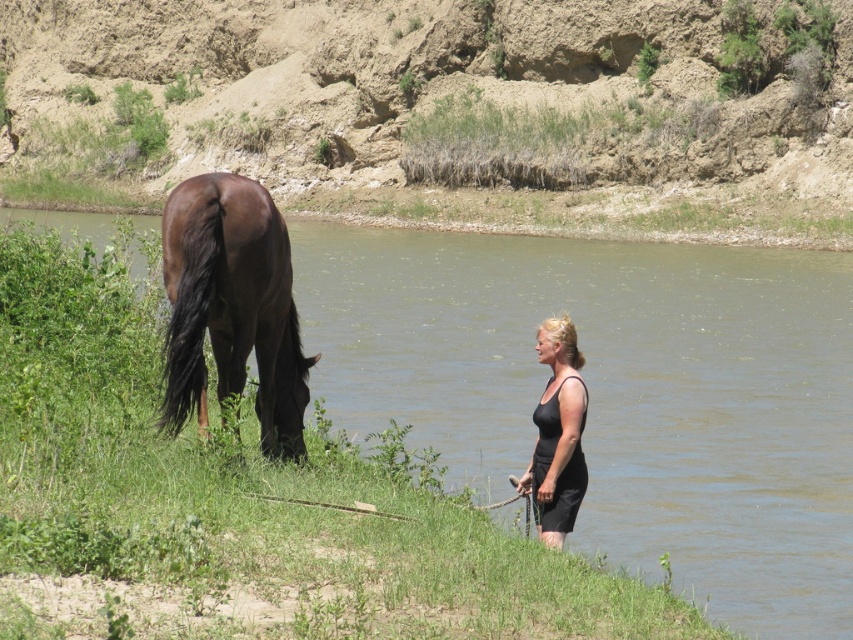
Find the location of `green grass at lower left`. green grass at lower left is located at coordinates (242, 497).

Which is behind, point (447, 529) or point (558, 456)?

Positioned behind is point (558, 456).

Image resolution: width=853 pixels, height=640 pixels. I want to click on green grass at lower left, so click(x=242, y=497).

Can you confirm if green grass at lower left is positioned above shiny dark brown horse at left?

No.

Is green grass at lower left further to camera compared to shiny dark brown horse at left?

No.

Is point (91, 307) positioned after point (187, 212)?

That is True.

You are a GUI agent. You are given a task and a screenshot of the screen. Output one action in this format:
    pyautogui.click(x=<x>, y=<y>)
    Task: Click on the green grass at lower left
    
    Given the screenshot: What is the action you would take?
    pyautogui.click(x=242, y=497)

Does shiny dark brown horse at left appear on the left side of black matte dress at lower right?

Yes, shiny dark brown horse at left is to the left of black matte dress at lower right.

Does shiny dark brown horse at left have a larger size compared to black matte dress at lower right?

Yes, shiny dark brown horse at left is bigger than black matte dress at lower right.

Find the location of a particular element. The width and height of the screenshot is (853, 640). shiny dark brown horse at left is located at coordinates (231, 307).